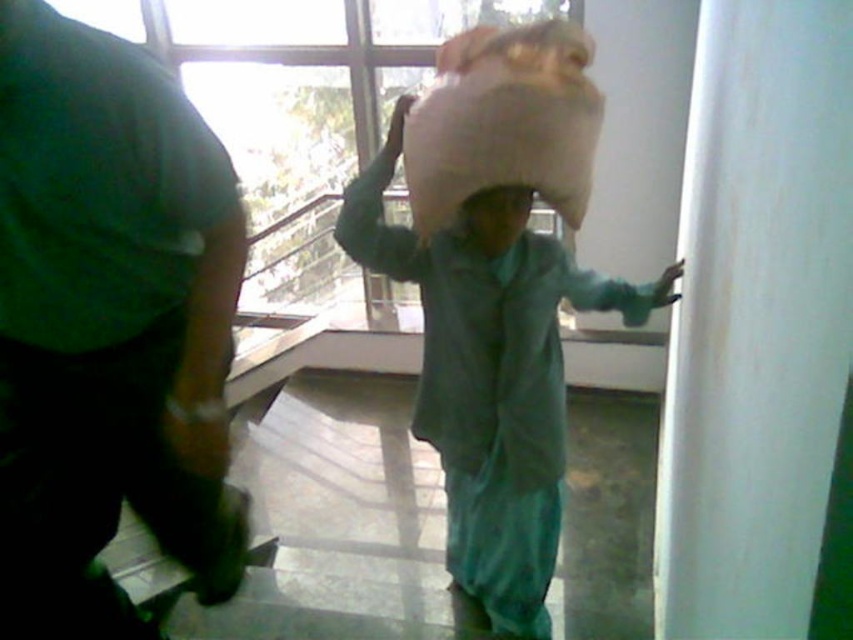
Between point (474, 506) and point (514, 202), which one is positioned behind?

Positioned behind is point (474, 506).

The image size is (853, 640). I want to click on beige fabric sack at center, so click(490, 385).

Identify the location of beige fabric sack at center. The image size is (853, 640). (490, 385).

Is the position of green matte shirt at left less distant than that of matte green head at center?

That is True.

Between green matte shirt at left and matte green head at center, which one has less height?

matte green head at center

Is point (33, 314) positioned after point (479, 195)?

No.

What are the coordinates of `green matte shirt at left` in the screenshot? It's located at (109, 326).

Does green matte shirt at left come in front of beige fabric sack at center?

Yes, it is in front of beige fabric sack at center.

Does green matte shirt at left appear on the left side of beige fabric sack at center?

Indeed, green matte shirt at left is positioned on the left side of beige fabric sack at center.

Measure the distance between green matte shirt at left and camera.

green matte shirt at left is 37.52 inches from camera.

Where is `green matte shirt at left`? green matte shirt at left is located at coordinates (109, 326).